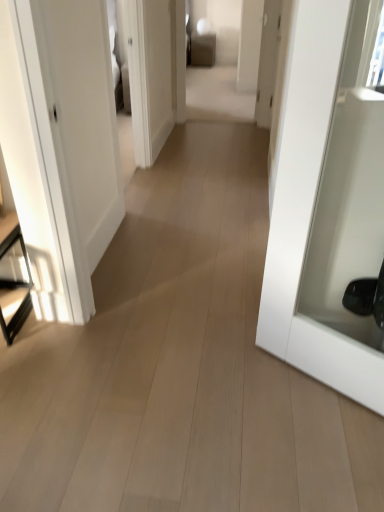
At what (x,y) coordinates should I click in order to perform the action: click on vacant region below white glossy door at right (from a real-world perspective). Please return your answer as a coordinate pair (x, y). Image resolution: width=384 pixels, height=512 pixels. Looking at the image, I should click on (303, 374).